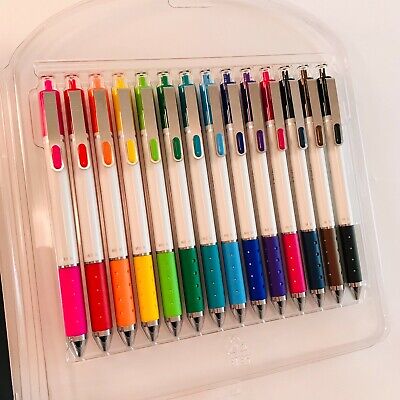
Where is `seven pens from the left of the row`? seven pens from the left of the row is located at coordinates (66, 235), (92, 227), (115, 224), (139, 220), (161, 214), (183, 210), (206, 205).